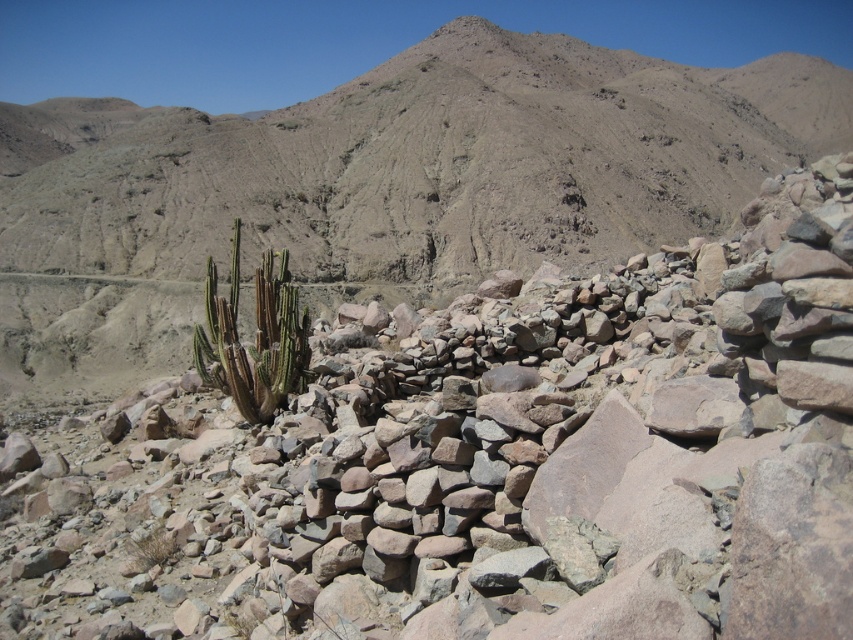
Question: Which point appears closest to the camera in this image?

Choices:
 (A) (229, 392)
 (B) (187, 522)

Answer: (B)

Question: From the image, what is the correct spatial relationship of dull brown rock at center in relation to green spiky cactus at lower left?

Choices:
 (A) left
 (B) right

Answer: (A)

Question: Is dull brown rock at center to the right of green spiny cactus at center from the viewer's perspective?

Choices:
 (A) no
 (B) yes

Answer: (B)

Question: Which point is farther from the camera taking this photo?

Choices:
 (A) (143, 560)
 (B) (740, 182)

Answer: (B)

Question: Among these points, which one is farthest from the camera?

Choices:
 (A) (238, 356)
 (B) (154, 545)

Answer: (A)

Question: Can you confirm if dull brown rock at center is wider than green spiny cactus at center?

Choices:
 (A) yes
 (B) no

Answer: (A)